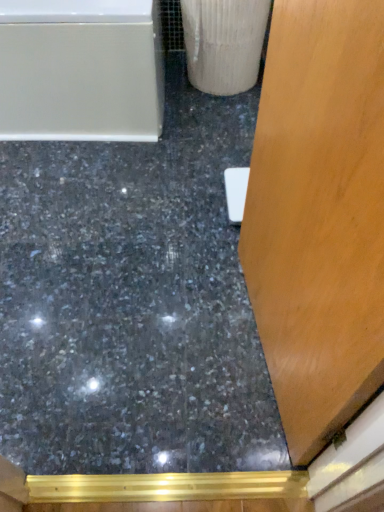
Question: In the image, is white glossy bathtub at upper left positioned in front of or behind shiny black concrete at center?

Choices:
 (A) front
 (B) behind

Answer: (B)

Question: From the image's perspective, is white glossy bathtub at upper left above or below shiny black concrete at center?

Choices:
 (A) below
 (B) above

Answer: (B)

Question: Considering the positions of point (150, 13) and point (16, 202), is point (150, 13) closer or farther from the camera than point (16, 202)?

Choices:
 (A) closer
 (B) farther

Answer: (A)

Question: Relative to white glossy bathtub at upper left, is shiny black concrete at center in front or behind?

Choices:
 (A) behind
 (B) front

Answer: (B)

Question: From the image's perspective, is shiny black concrete at center located above or below white glossy bathtub at upper left?

Choices:
 (A) above
 (B) below

Answer: (B)

Question: Considering the positions of shiny black concrete at center and white glossy bathtub at upper left in the image, is shiny black concrete at center wider or thinner than white glossy bathtub at upper left?

Choices:
 (A) wide
 (B) thin

Answer: (A)

Question: Based on their positions, is shiny black concrete at center located to the left or right of white glossy bathtub at upper left?

Choices:
 (A) right
 (B) left

Answer: (A)